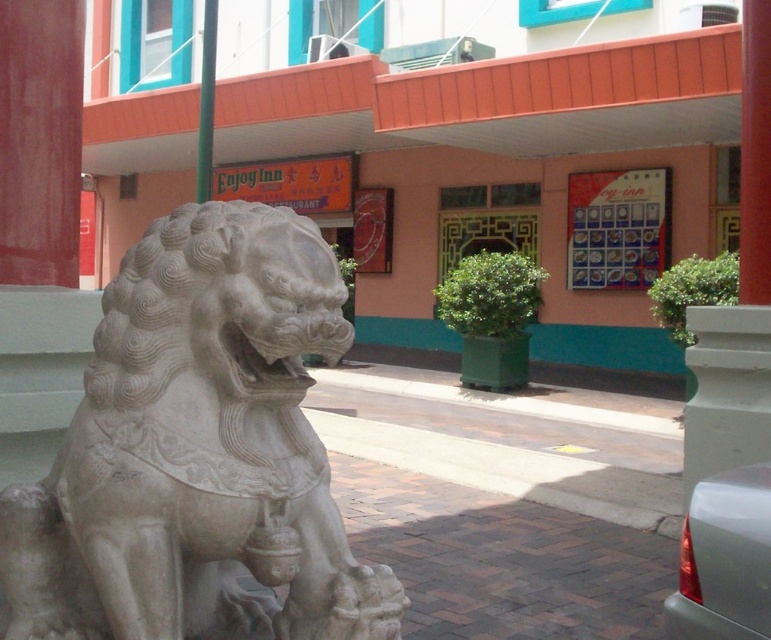
Between satin silver car at lower right and white stone pillar at center, which one appears on the left side from the viewer's perspective?

satin silver car at lower right

Is point (761, 486) closer to viewer compared to point (722, 436)?

Yes.

Where is `satin silver car at lower right`? satin silver car at lower right is located at coordinates (724, 560).

Does point (712, 609) come in front of point (761, 77)?

Yes, point (712, 609) is closer to viewer.

Is point (668, 608) in front of point (763, 256)?

That is True.

What are the coordinates of `satin silver car at lower right` in the screenshot? It's located at (724, 560).

Which of these two, white stone pillar at center or red matte pillar at center, stands shorter?

With less height is white stone pillar at center.

Between point (759, 380) and point (756, 48), which one is positioned behind?

The point (756, 48) is more distant.

I want to click on white stone pillar at center, so click(x=726, y=392).